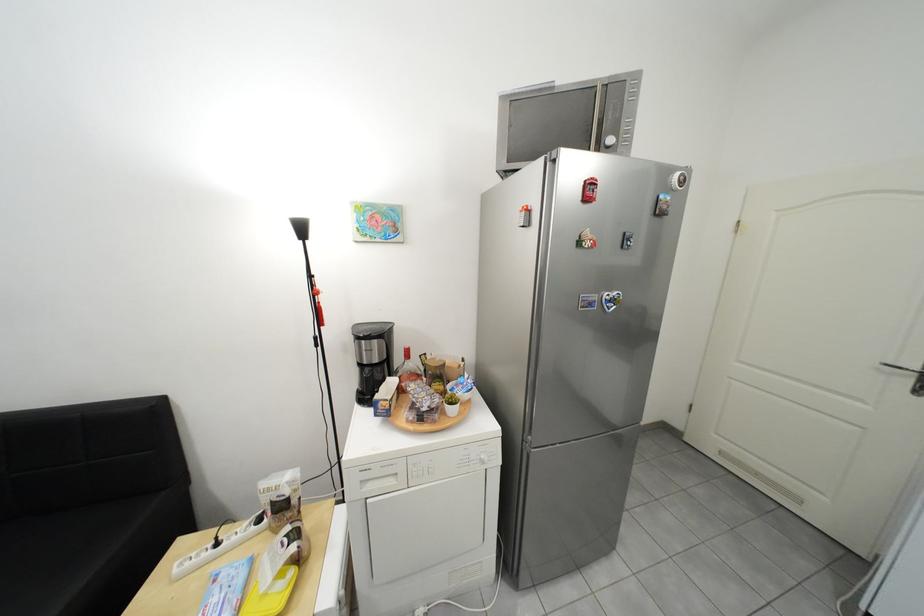
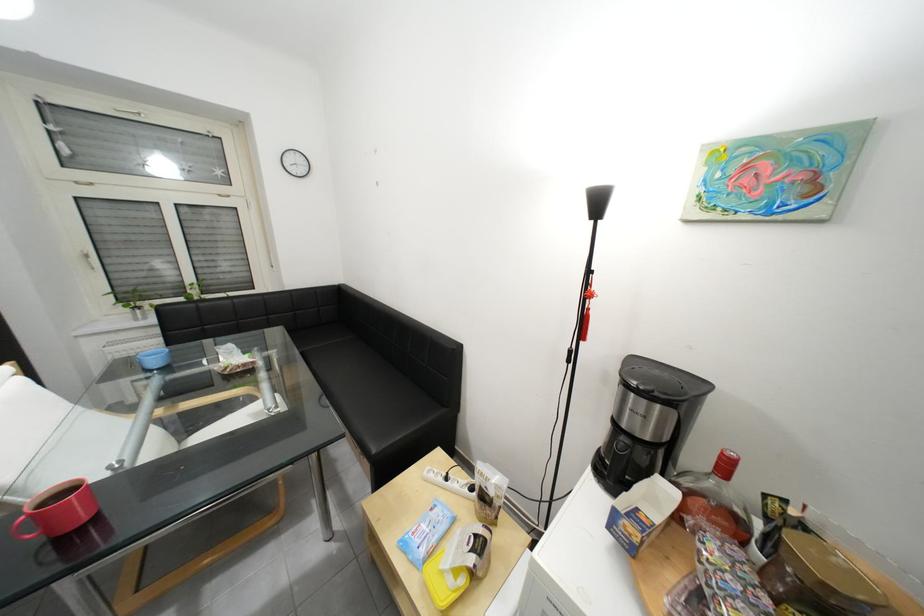
The point at (x=300, y=530) is marked in the first image. Where is the corresponding point in the second image?

(492, 531)